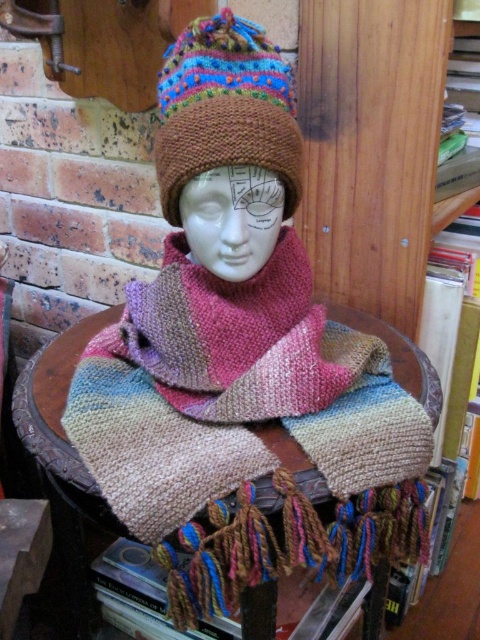
Does knitted woolen hat at center have a larger size compared to knitted fabric at center?

No, knitted woolen hat at center is not bigger than knitted fabric at center.

Does point (239, 77) come closer to viewer compared to point (41, 435)?

Yes, it is in front of point (41, 435).

What do you see at coordinates (225, 108) in the screenshot? I see `knitted woolen hat at center` at bounding box center [225, 108].

The height and width of the screenshot is (640, 480). In order to click on knitted woolen hat at center in this screenshot , I will do `click(225, 108)`.